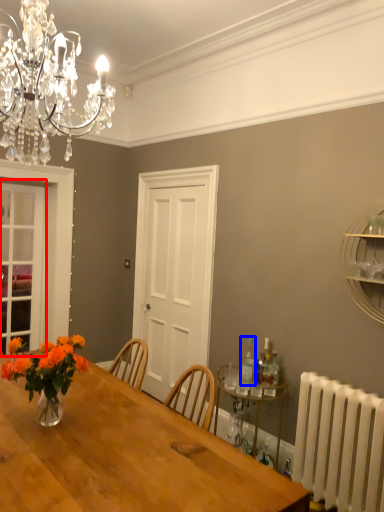
Question: Among these objects, which one is farthest to the camera, glass door (highlighted by a red box) or bottle (highlighted by a blue box)?

Choices:
 (A) glass door
 (B) bottle

Answer: (A)